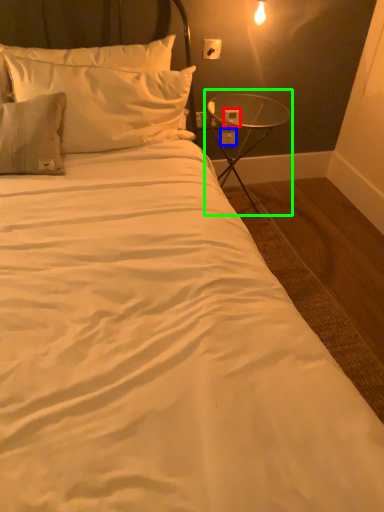
Question: Which object is the closest to the electric outlet (highlighted by a red box)? Choose among these: electric outlet (highlighted by a blue box) or table (highlighted by a green box).

Choices:
 (A) electric outlet
 (B) table

Answer: (B)